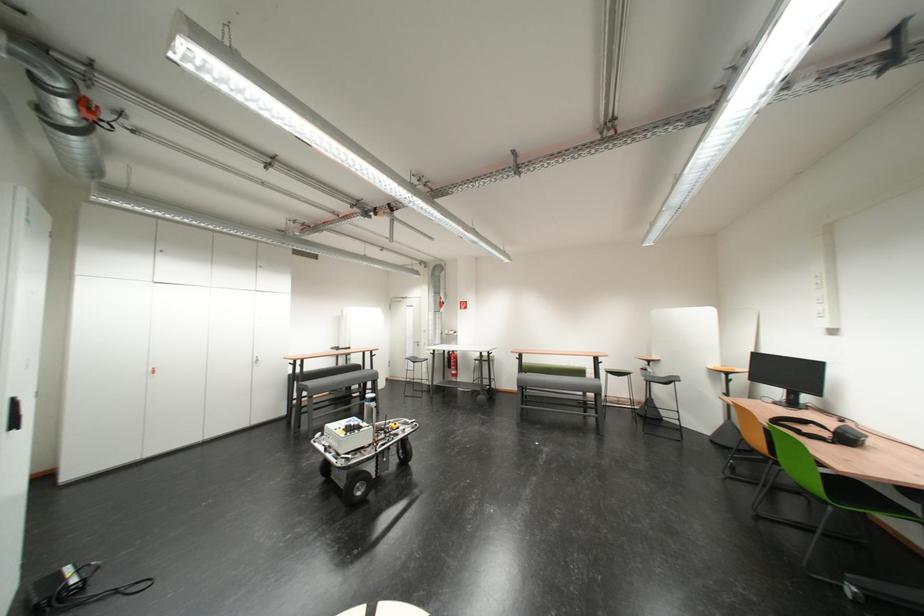
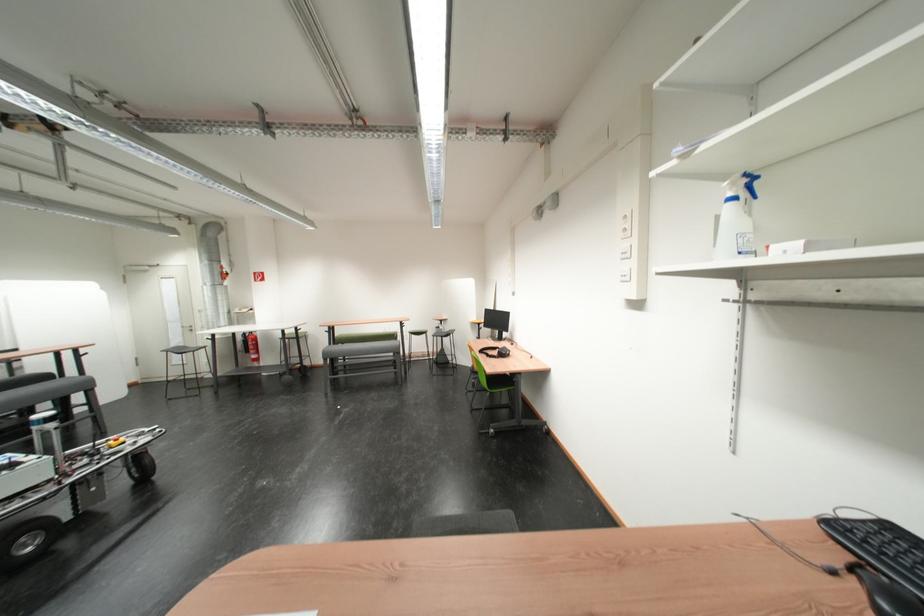
Question: The images are taken continuously from a first-person perspective. In which direction is your viewpoint rotating?

Choices:
 (A) Left
 (B) Right
 (C) Up
 (D) Down

Answer: (B)